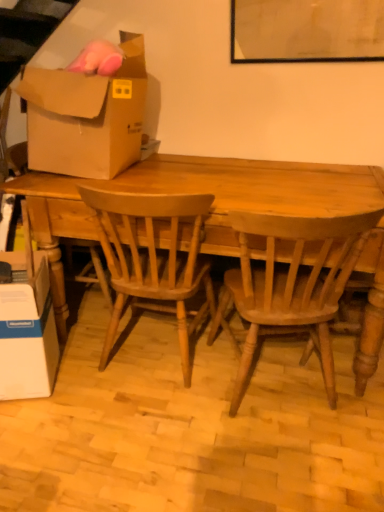
Question: From a real-world perspective, is light brown wood chair at center, arranged as the 1th chair when viewed from the right, beneath white cardboard box at lower left, positioned as the 2th box in top-to-bottom order?

Choices:
 (A) no
 (B) yes

Answer: (A)

Question: Would you consider light brown wood chair at center, arranged as the 1th chair when viewed from the right, to be distant from white cardboard box at lower left, positioned as the 2th box in top-to-bottom order?

Choices:
 (A) no
 (B) yes

Answer: (A)

Question: Is light brown wood chair at center, arranged as the 1th chair when viewed from the right, thinner than white cardboard box at lower left, arranged as the 1th box when ordered from the bottom?

Choices:
 (A) no
 (B) yes

Answer: (A)

Question: Does light brown wood chair at center, arranged as the 1th chair when viewed from the right, appear on the right side of white cardboard box at lower left, positioned as the 2th box in top-to-bottom order?

Choices:
 (A) yes
 (B) no

Answer: (A)

Question: From a real-world perspective, is light brown wood chair at center, arranged as the 1th chair when viewed from the right, physically above white cardboard box at lower left, positioned as the 2th box in top-to-bottom order?

Choices:
 (A) no
 (B) yes

Answer: (B)

Question: Is light brown wood chair at center, the second chair when ordered from left to right, next to white cardboard box at lower left, arranged as the 1th box when ordered from the bottom, and touching it?

Choices:
 (A) no
 (B) yes

Answer: (A)

Question: Is wooden table at center completely or partially outside of white cardboard box at lower left, arranged as the 1th box when ordered from the bottom?

Choices:
 (A) no
 (B) yes

Answer: (B)

Question: Is the depth of wooden table at center greater than that of white cardboard box at lower left, arranged as the 1th box when ordered from the bottom?

Choices:
 (A) yes
 (B) no

Answer: (B)

Question: From a real-world perspective, is wooden table at center beneath white cardboard box at lower left, positioned as the 2th box in top-to-bottom order?

Choices:
 (A) no
 (B) yes

Answer: (A)

Question: Considering the relative sizes of wooden table at center and white cardboard box at lower left, positioned as the 2th box in top-to-bottom order, in the image provided, is wooden table at center taller than white cardboard box at lower left, positioned as the 2th box in top-to-bottom order,?

Choices:
 (A) no
 (B) yes

Answer: (B)

Question: Is white cardboard box at lower left, arranged as the 1th box when ordered from the bottom, located within wooden table at center?

Choices:
 (A) no
 (B) yes

Answer: (A)

Question: From a real-world perspective, does wooden table at center stand above white cardboard box at lower left, positioned as the 2th box in top-to-bottom order?

Choices:
 (A) no
 (B) yes

Answer: (B)

Question: Considering the relative sizes of white cardboard box at lower left, arranged as the 1th box when ordered from the bottom, and brown cardboard box at upper left, placed as the 1th box when sorted from top to bottom, in the image provided, is white cardboard box at lower left, arranged as the 1th box when ordered from the bottom, shorter than brown cardboard box at upper left, placed as the 1th box when sorted from top to bottom,?

Choices:
 (A) yes
 (B) no

Answer: (A)